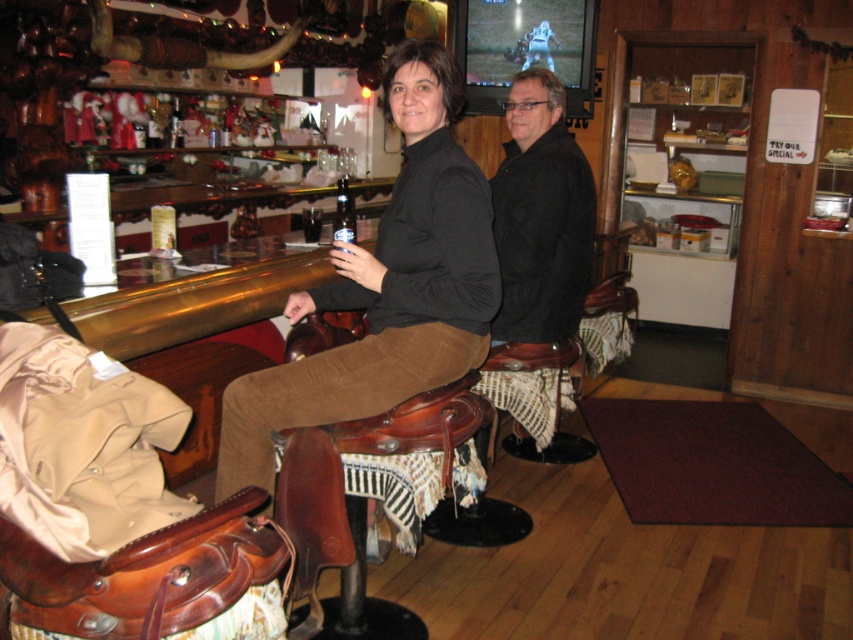
You are a photographer trying to capture both the matte black jacket at center and the black matte jacket at center in a single frame. Since they are very similar in appearance, you need to adjust your camera angle to focus on their size difference. Which jacket should you zoom in on to ensure both are clearly visible in the photo?

The matte black jacket at center is larger in size than the black matte jacket at center. To ensure both are clearly visible, you should zoom in on the matte black jacket at center as it is the larger one, allowing the smaller black matte jacket at center to still be in frame without being too small.

You are a customer at the bar and want to place your matte black jacket at center on the bar counter. Is there enough space for it?

The matte black jacket at center is located at point (386,285), which is on the bar counter. Since the bar counter has space for various bottles and glasses, there should be enough space to place the matte black jacket at center there.